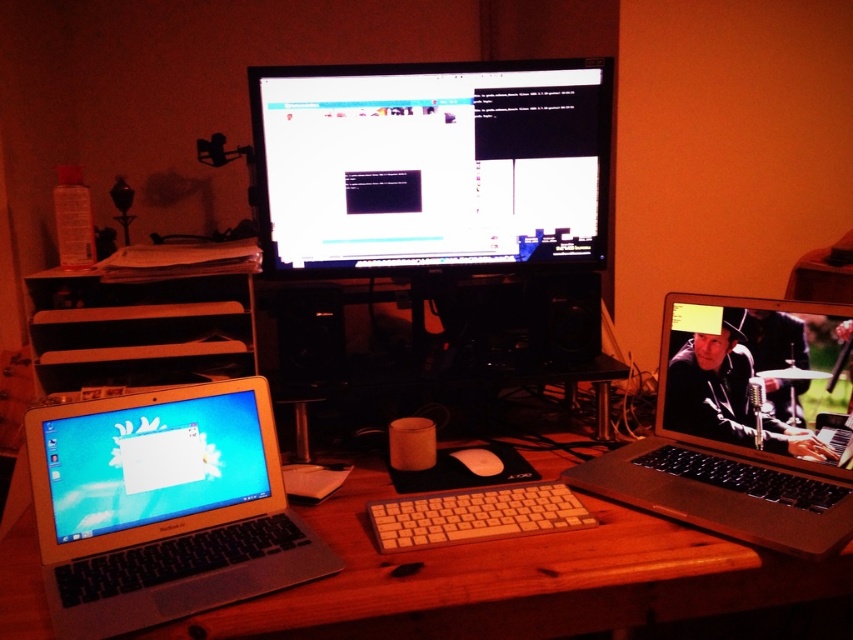
Question: Which point appears farthest from the camera in this image?

Choices:
 (A) (103, 456)
 (B) (469, 464)
 (C) (334, 195)
 (D) (747, 397)

Answer: (C)

Question: Can you confirm if silver metallic laptop at right is positioned below matte black laptop at upper center?

Choices:
 (A) yes
 (B) no

Answer: (A)

Question: Observing the image, what is the correct spatial positioning of silver metallic laptop at lower left in reference to silver metallic laptop at right?

Choices:
 (A) right
 (B) left

Answer: (B)

Question: Considering the real-world distances, which object is closest to the white matte mouse at center?

Choices:
 (A) silver metallic laptop at lower left
 (B) shiny silver laptop at lower left
 (C) wooden desk at center

Answer: (C)

Question: Does silver metallic laptop at right appear on the right side of white plastic keyboard at center?

Choices:
 (A) yes
 (B) no

Answer: (A)

Question: Among these points, which one is nearest to the camera?

Choices:
 (A) (309, 244)
 (B) (781, 310)
 (C) (189, 476)
 (D) (438, 522)

Answer: (D)